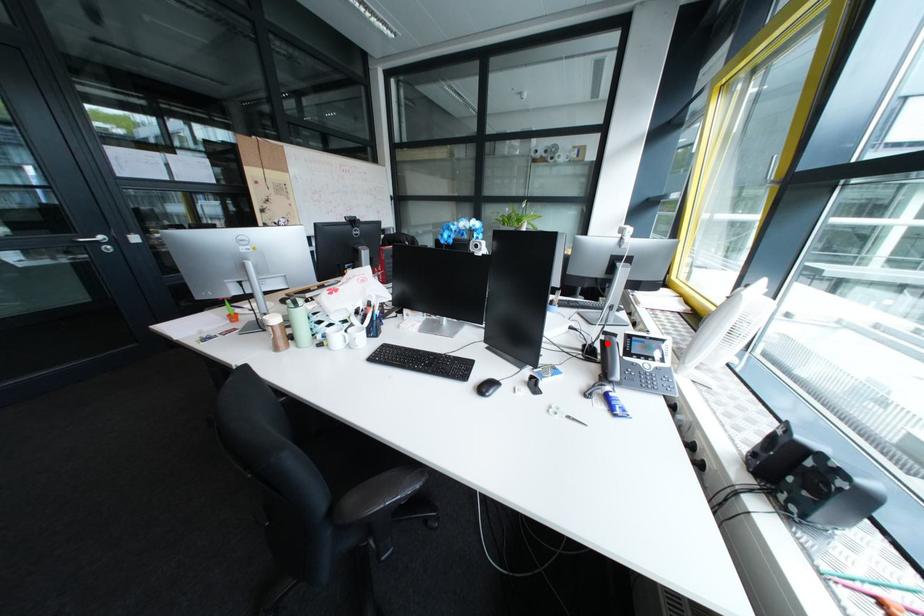
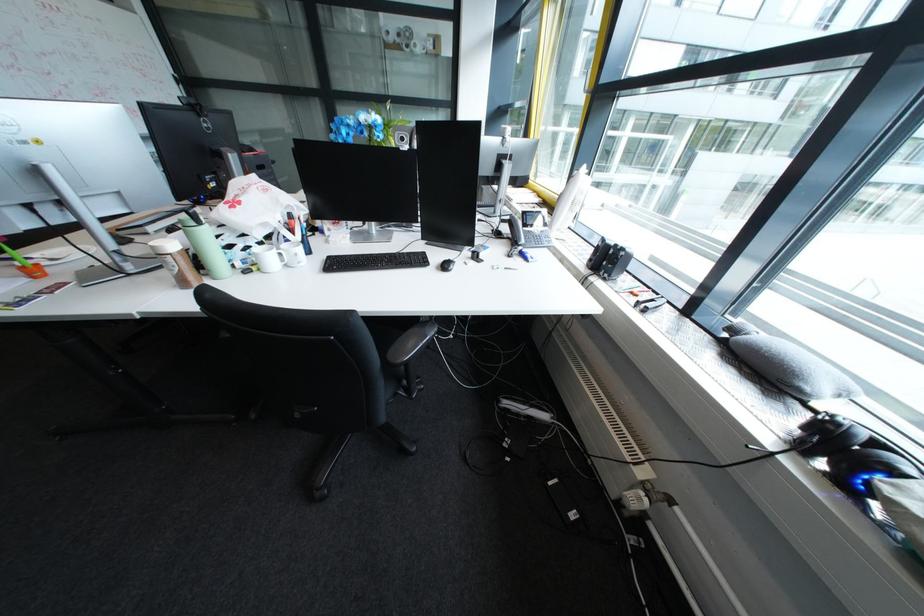
In the second image, find the point that corresponds to the highlighted location in the first image.

(512, 228)